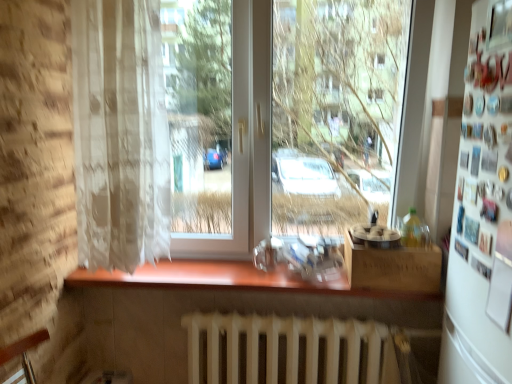
Locate an element on the screen. This screenshot has height=384, width=512. vacant space situated above wooden box at lower right (from a real-world perspective) is located at coordinates (381, 239).